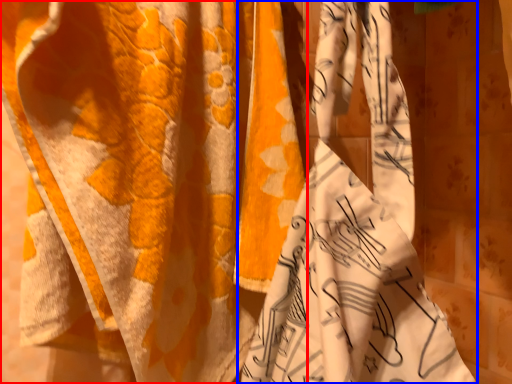
Question: Which of the following is the closest to the observer, curtain (highlighted by a red box) or curtain (highlighted by a blue box)?

Choices:
 (A) curtain
 (B) curtain

Answer: (B)